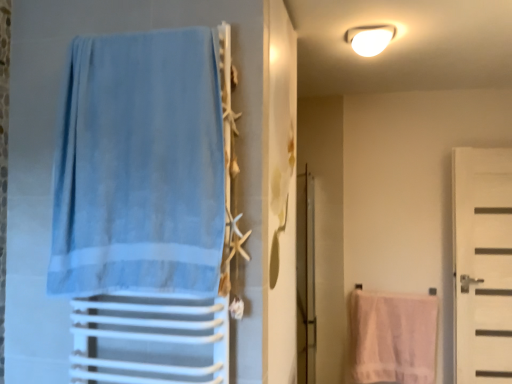
Question: From the image's perspective, is clear glass screen door at center located beneath white matte door at right?

Choices:
 (A) no
 (B) yes

Answer: (B)

Question: Is clear glass screen door at center far away from white matte door at right?

Choices:
 (A) no
 (B) yes

Answer: (B)

Question: Is clear glass screen door at center not within white matte door at right?

Choices:
 (A) yes
 (B) no

Answer: (A)

Question: Is clear glass screen door at center bigger than white matte door at right?

Choices:
 (A) yes
 (B) no

Answer: (A)

Question: Does clear glass screen door at center come in front of white matte door at right?

Choices:
 (A) yes
 (B) no

Answer: (A)

Question: From their relative heights in the image, would you say light blue fabric towel at left is taller or shorter than white matte door at right?

Choices:
 (A) tall
 (B) short

Answer: (B)

Question: From a real-world perspective, is light blue fabric towel at left positioned above or below white matte door at right?

Choices:
 (A) below
 (B) above

Answer: (B)

Question: From the image's perspective, is light blue fabric towel at left above or below white matte door at right?

Choices:
 (A) above
 (B) below

Answer: (A)

Question: Is light blue fabric towel at left inside or outside of white matte door at right?

Choices:
 (A) outside
 (B) inside

Answer: (A)

Question: Is clear glass screen door at center bigger or smaller than white matte door at right?

Choices:
 (A) small
 (B) big

Answer: (B)

Question: Looking at their shapes, would you say clear glass screen door at center is wider or thinner than white matte door at right?

Choices:
 (A) wide
 (B) thin

Answer: (A)

Question: Is clear glass screen door at center in front of or behind white matte door at right in the image?

Choices:
 (A) front
 (B) behind

Answer: (A)

Question: From a real-world perspective, is clear glass screen door at center positioned above or below white matte door at right?

Choices:
 (A) below
 (B) above

Answer: (A)

Question: In terms of height, does white textured towel at lower right look taller or shorter compared to white matte door at right?

Choices:
 (A) short
 (B) tall

Answer: (A)

Question: Considering the positions of white textured towel at lower right and white matte door at right in the image, is white textured towel at lower right wider or thinner than white matte door at right?

Choices:
 (A) wide
 (B) thin

Answer: (B)